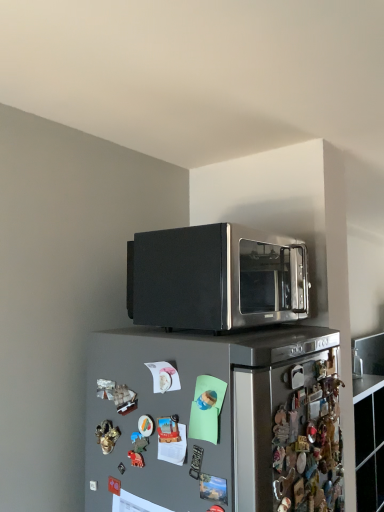
Question: Do you think satin black microwave at upper center is within satin silver refrigerator at upper center, or outside of it?

Choices:
 (A) inside
 (B) outside

Answer: (B)

Question: From the image's perspective, is satin black microwave at upper center located above or below satin silver refrigerator at upper center?

Choices:
 (A) below
 (B) above

Answer: (B)

Question: Looking at their shapes, would you say satin black microwave at upper center is wider or thinner than satin silver refrigerator at upper center?

Choices:
 (A) thin
 (B) wide

Answer: (A)

Question: From the image's perspective, relative to satin black microwave at upper center, is satin silver refrigerator at upper center above or below?

Choices:
 (A) below
 (B) above

Answer: (A)

Question: Is satin silver refrigerator at upper center wider or thinner than satin black microwave at upper center?

Choices:
 (A) wide
 (B) thin

Answer: (A)

Question: From a real-world perspective, relative to satin black microwave at upper center, is satin silver refrigerator at upper center vertically above or below?

Choices:
 (A) above
 (B) below

Answer: (B)

Question: Is satin silver refrigerator at upper center in front of or behind satin black microwave at upper center in the image?

Choices:
 (A) front
 (B) behind

Answer: (A)